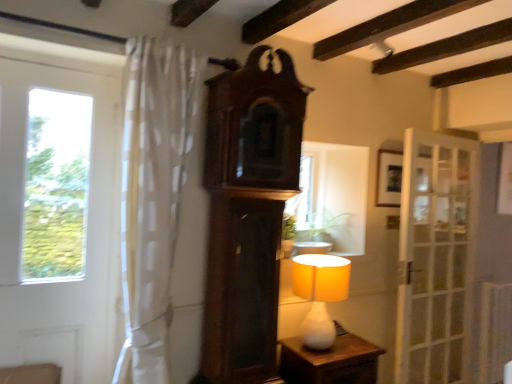
Question: Is white glossy nightstand at lower center looking in the opposite direction of green leafy plant at center?

Choices:
 (A) yes
 (B) no

Answer: (B)

Question: Is white glossy nightstand at lower center positioned in front of green leafy plant at center?

Choices:
 (A) no
 (B) yes

Answer: (B)

Question: Would you say white glossy nightstand at lower center is a long distance from green leafy plant at center?

Choices:
 (A) no
 (B) yes

Answer: (A)

Question: Considering the relative sizes of white glossy nightstand at lower center and green leafy plant at center in the image provided, is white glossy nightstand at lower center bigger than green leafy plant at center?

Choices:
 (A) yes
 (B) no

Answer: (A)

Question: Is white glossy nightstand at lower center smaller than green leafy plant at center?

Choices:
 (A) yes
 (B) no

Answer: (B)

Question: From the image's perspective, is white glossy nightstand at lower center beneath green leafy plant at center?

Choices:
 (A) yes
 (B) no

Answer: (A)

Question: Is dark wood clock at center bigger than white sheer curtain at left?

Choices:
 (A) no
 (B) yes

Answer: (A)

Question: Is dark wood clock at center oriented towards white sheer curtain at left?

Choices:
 (A) yes
 (B) no

Answer: (B)

Question: Is dark wood clock at center positioned behind white sheer curtain at left?

Choices:
 (A) no
 (B) yes

Answer: (B)

Question: Considering the relative sizes of dark wood clock at center and white sheer curtain at left in the image provided, is dark wood clock at center thinner than white sheer curtain at left?

Choices:
 (A) no
 (B) yes

Answer: (B)

Question: From the image's perspective, is dark wood clock at center located above white sheer curtain at left?

Choices:
 (A) no
 (B) yes

Answer: (A)

Question: From a real-world perspective, is dark wood clock at center beneath white sheer curtain at left?

Choices:
 (A) yes
 (B) no

Answer: (A)

Question: Considering the relative sizes of green leafy plant at center and white glass door at right, placed as the 2th door when sorted from left to right, in the image provided, is green leafy plant at center shorter than white glass door at right, placed as the 2th door when sorted from left to right,?

Choices:
 (A) no
 (B) yes

Answer: (B)